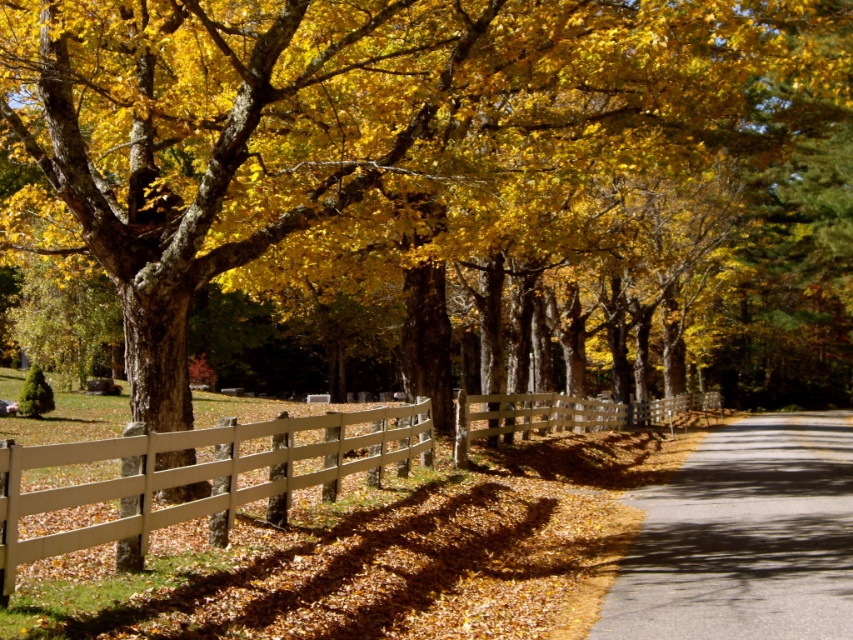
You are a painter standing at the starting point of the gray asphalt road at center, aiming to paint the white wooden fence at center. Given that your longest brush can reach 15 feet, will you be able to paint the fence without moving closer?

The gray asphalt road at center is 16.78 feet away from the white wooden fence at center. Since your longest brush can only reach 15 feet, you will not be able to paint the fence without moving closer.

You are standing at the side of the road and want to walk to the grassy area beyond the white wooden fence at center. Which direction should you go relative to the gray asphalt road at center?

You should go to the left side of the gray asphalt road at center because the white wooden fence at center is on the left side of the road, and the grassy area is beyond the fence.

You are standing at the point marked as point (744, 538) in the image. Which object is directly under your feet?

The gray asphalt road at center is located at point (744, 538), so the object directly under your feet is the gray asphalt road at center.